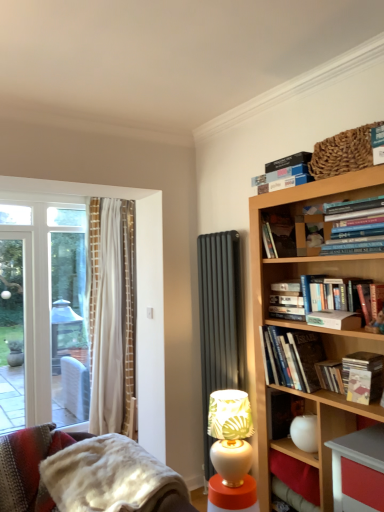
Question: Is fuzzy woolen blanket at lower left aimed at hardcover book at center-right, arranged as the first paperback book when ordered from the bottom?

Choices:
 (A) no
 (B) yes

Answer: (A)

Question: Considering the relative positions of fuzzy woolen blanket at lower left and hardcover book at center-right, arranged as the first paperback book when ordered from the bottom, in the image provided, is fuzzy woolen blanket at lower left to the left of hardcover book at center-right, arranged as the first paperback book when ordered from the bottom, from the viewer's perspective?

Choices:
 (A) no
 (B) yes

Answer: (B)

Question: Is fuzzy woolen blanket at lower left beside hardcover book at center-right, which is the 5th paperback book from top to bottom?

Choices:
 (A) no
 (B) yes

Answer: (A)

Question: From the image's perspective, would you say fuzzy woolen blanket at lower left is positioned over hardcover book at center-right, arranged as the first paperback book when ordered from the bottom?

Choices:
 (A) no
 (B) yes

Answer: (A)

Question: From a real-world perspective, is fuzzy woolen blanket at lower left positioned over hardcover book at center-right, arranged as the first paperback book when ordered from the bottom, based on gravity?

Choices:
 (A) yes
 (B) no

Answer: (B)

Question: Is the position of fuzzy woolen blanket at lower left more distant than that of hardcover book at center-right, arranged as the first paperback book when ordered from the bottom?

Choices:
 (A) yes
 (B) no

Answer: (B)

Question: Is hardcover book at center-right, arranged as the first paperback book when ordered from the bottom, at the right side of hardcover book at upper right, the 1th paperback book positioned from the top?

Choices:
 (A) no
 (B) yes

Answer: (A)

Question: Is hardcover book at center-right, which is the 5th paperback book from top to bottom, not within hardcover book at upper right, the 1th paperback book positioned from the top?

Choices:
 (A) no
 (B) yes

Answer: (B)

Question: Is hardcover book at upper right, which is the 5th paperback book in bottom-to-top order, surrounded by hardcover book at center-right, which is the 5th paperback book from top to bottom?

Choices:
 (A) no
 (B) yes

Answer: (A)

Question: From the image's perspective, is hardcover book at center-right, arranged as the first paperback book when ordered from the bottom, below hardcover book at upper right, which is the 5th paperback book in bottom-to-top order?

Choices:
 (A) no
 (B) yes

Answer: (B)

Question: Does hardcover book at center-right, which is the 5th paperback book from top to bottom, appear on the left side of hardcover book at upper right, which is the 5th paperback book in bottom-to-top order?

Choices:
 (A) no
 (B) yes

Answer: (B)

Question: Are hardcover book at center-right, which is the 5th paperback book from top to bottom, and hardcover book at upper right, the 1th paperback book positioned from the top, located far from each other?

Choices:
 (A) yes
 (B) no

Answer: (A)

Question: Can you confirm if hardcover book at upper right, placed as the 5th book when sorted from top to bottom, is bigger than fuzzy woolen blanket at lower left?

Choices:
 (A) no
 (B) yes

Answer: (A)